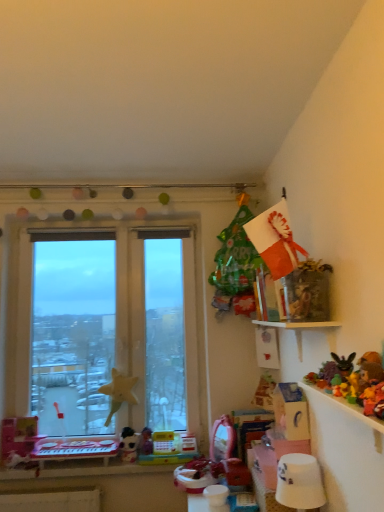
At what (x,y) coordinates should I click in order to perform the action: click on white glossy lampshade at lower right. Please return your answer as a coordinate pair (x, y). Looking at the image, I should click on (299, 482).

What is the approximate width of white glossy lampshade at lower right?

It is 7.90 inches.

Locate an element on the screen. Image resolution: width=384 pixels, height=512 pixels. white plush toy at lower center, positioned as the 1th toy in back-to-front order is located at coordinates (128, 445).

What do you see at coordinates (371, 368) in the screenshot? I see `fluffy yellow teddy bear at upper right, positioned as the 4th toy in bottom-to-top order` at bounding box center [371, 368].

What do you see at coordinates (335, 386) in the screenshot? I see `multicolored plastic toy at upper right, which is the 3th toy in front-to-back order` at bounding box center [335, 386].

Describe the element at coordinates (373, 400) in the screenshot. The width and height of the screenshot is (384, 512). I see `plush yellow rabbit at upper right, the first toy viewed from the front` at that location.

Measure the distance between point (110, 275) and camera.

A distance of 8.73 feet exists between point (110, 275) and camera.

Identify the location of white glossy lampshade at lower right. This screenshot has height=512, width=384. (299, 482).

From the image's perspective, which is below, white plastic table at lower left or multicolored plastic toy at upper right, the 2th toy viewed from the left?

From the image's view, white plastic table at lower left is below.

How different are the orientations of white plastic table at lower left and multicolored plastic toy at upper right, the second toy from the back, in degrees?

90.9 degrees.

Would you say white plastic table at lower left is to the left or to the right of multicolored plastic toy at upper right, marked as the 3th toy in a right-to-left arrangement, in the picture?

Clearly, white plastic table at lower left is on the left of multicolored plastic toy at upper right, marked as the 3th toy in a right-to-left arrangement, in the image.

Image resolution: width=384 pixels, height=512 pixels. What are the coordinates of `table on the left of the multicolored plastic toy at upper right, positioned as the 3th toy in top-to-bottom order` in the screenshot? It's located at (74, 449).

From the picture: In terms of height, does multicolored plastic toy at upper right, positioned as the 3th toy in top-to-bottom order, look taller or shorter compared to plush yellow rabbit at upper right, the fourth toy from the back?

Considering their sizes, multicolored plastic toy at upper right, positioned as the 3th toy in top-to-bottom order, has less height than plush yellow rabbit at upper right, the fourth toy from the back.

Is multicolored plastic toy at upper right, the second toy from the bottom, beside plush yellow rabbit at upper right, placed as the 3th toy when sorted from left to right?

No, multicolored plastic toy at upper right, the second toy from the bottom, is not with plush yellow rabbit at upper right, placed as the 3th toy when sorted from left to right.

Does multicolored plastic toy at upper right, marked as the 3th toy in a right-to-left arrangement, have a larger size compared to plush yellow rabbit at upper right, which is the 3th toy in bottom-to-top order?

Actually, multicolored plastic toy at upper right, marked as the 3th toy in a right-to-left arrangement, might be smaller than plush yellow rabbit at upper right, which is the 3th toy in bottom-to-top order.

From the image's perspective, who appears lower, plush yellow rabbit at upper right, which is the 3th toy in bottom-to-top order, or white plastic table at lower left?

white plastic table at lower left, from the image's perspective.

Is plush yellow rabbit at upper right, placed as the 3th toy when sorted from left to right, turned away from white plastic table at lower left?

No, plush yellow rabbit at upper right, placed as the 3th toy when sorted from left to right,'s orientation is not away from white plastic table at lower left.

Where is `table that appears below the plush yellow rabbit at upper right, which is the 3th toy in bottom-to-top order (from a real-world perspective)`? table that appears below the plush yellow rabbit at upper right, which is the 3th toy in bottom-to-top order (from a real-world perspective) is located at coordinates (74, 449).

Which is behind, point (166, 262) or point (291, 483)?

Point (166, 262)

Is transparent glass window at left looking in the opposite direction of white glossy lampshade at lower right?

transparent glass window at left does not have its back to white glossy lampshade at lower right.

Considering the positions of objects transparent glass window at left and white glossy lampshade at lower right in the image provided, who is more to the left, transparent glass window at left or white glossy lampshade at lower right?

Positioned to the left is transparent glass window at left.

Where is `window behind the white glossy lampshade at lower right`? This screenshot has height=512, width=384. window behind the white glossy lampshade at lower right is located at coordinates (108, 327).

Is plush yellow rabbit at upper right, which is the 3th toy in bottom-to-top order, next to white glossy lampshade at lower right and touching it?

No, plush yellow rabbit at upper right, which is the 3th toy in bottom-to-top order, is not in contact with white glossy lampshade at lower right.

Considering the sizes of objects plush yellow rabbit at upper right, the 2th toy from the right, and white glossy lampshade at lower right in the image provided, who is smaller, plush yellow rabbit at upper right, the 2th toy from the right, or white glossy lampshade at lower right?

With smaller size is plush yellow rabbit at upper right, the 2th toy from the right.

From the white glossy lampshade at lower right, count 3rd toys forward and point to it. Please provide its 2D coordinates.

[(373, 400)]

Can you tell me how much plush yellow rabbit at upper right, the first toy viewed from the front, and white glossy lampshade at lower right differ in facing direction?

plush yellow rabbit at upper right, the first toy viewed from the front, and white glossy lampshade at lower right are facing 1.79 degrees away from each other.

Relative to white plush toy at lower center, placed as the fourth toy when sorted from front to back, is transparent glass window at left in front or behind?

Visually, transparent glass window at left is located behind white plush toy at lower center, placed as the fourth toy when sorted from front to back.

Is transparent glass window at left inside the boundaries of white plush toy at lower center, placed as the fourth toy when sorted from front to back, or outside?

transparent glass window at left exists outside the volume of white plush toy at lower center, placed as the fourth toy when sorted from front to back.

Is transparent glass window at left oriented away from white plush toy at lower center, which is counted as the fourth toy, starting from the right?

Yes, transparent glass window at left's orientation is away from white plush toy at lower center, which is counted as the fourth toy, starting from the right.

In terms of width, does transparent glass window at left look wider or thinner when compared to white plush toy at lower center, positioned as the 1th toy in back-to-front order?

Considering their sizes, transparent glass window at left looks broader than white plush toy at lower center, positioned as the 1th toy in back-to-front order.

Which of these two, plush yellow rabbit at upper right, the first toy viewed from the front, or white plush toy at lower center, which is the first toy from bottom to top, is smaller?

With smaller size is plush yellow rabbit at upper right, the first toy viewed from the front.

Would you say white plush toy at lower center, which is the first toy from bottom to top, is part of plush yellow rabbit at upper right, the 2th toy from the right,'s contents?

No.

Does plush yellow rabbit at upper right, the fourth toy from the back, turn towards white plush toy at lower center, positioned as the 1th toy in back-to-front order?

No, plush yellow rabbit at upper right, the fourth toy from the back, is not facing towards white plush toy at lower center, positioned as the 1th toy in back-to-front order.

Does point (370, 405) lie in front of point (133, 430)?

That is True.

You are a GUI agent. You are given a task and a screenshot of the screen. Output one action in this format:
    pyautogui.click(x=<x>, y=<y>)
    Task: Click on the 2nd toy above the white plastic table at lower left (from the image's perspective)
    
    Given the screenshot: What is the action you would take?
    pyautogui.click(x=335, y=386)

Identify the location of the 1st toy to the right when counting from the multicolored plastic toy at upper right, the 2th toy viewed from the left. (373, 400).

Considering their positions, is multicolored plastic toy at upper right, marked as the 3th toy in a right-to-left arrangement, positioned closer to white glossy lampshade at lower right than white plastic table at lower left?

The object closer to white glossy lampshade at lower right is multicolored plastic toy at upper right, marked as the 3th toy in a right-to-left arrangement.

Which object lies nearer to the anchor point plush yellow rabbit at upper right, which is the 3th toy in bottom-to-top order, white plastic table at lower left or white plush toy at lower center, arranged as the first toy when viewed from the left?

white plush toy at lower center, arranged as the first toy when viewed from the left, is positioned closer to the anchor plush yellow rabbit at upper right, which is the 3th toy in bottom-to-top order.

Estimate the real-world distances between objects in this image. Which object is further from white glossy lampshade at lower right, white plush toy at lower center, which is the first toy from bottom to top, or multicolored plastic toy at upper right, positioned as the 3th toy in top-to-bottom order?

The object further to white glossy lampshade at lower right is white plush toy at lower center, which is the first toy from bottom to top.

Which object lies further to the anchor point white plush toy at lower center, placed as the fourth toy when sorted from front to back, multicolored plastic toy at upper right, the second toy from the back, or white plastic table at lower left?

multicolored plastic toy at upper right, the second toy from the back, lies further to white plush toy at lower center, placed as the fourth toy when sorted from front to back, than the other object.

Which object lies nearer to the anchor point fluffy yellow teddy bear at upper right, which is counted as the fourth toy, starting from the left, white plastic table at lower left or transparent glass window at left?

Based on the image, transparent glass window at left appears to be nearer to fluffy yellow teddy bear at upper right, which is counted as the fourth toy, starting from the left.

Looking at the image, which one is located further to multicolored plastic toy at upper right, positioned as the 3th toy in top-to-bottom order, white plastic table at lower left or white plush toy at lower center, arranged as the first toy when viewed from the left?

white plastic table at lower left is further to multicolored plastic toy at upper right, positioned as the 3th toy in top-to-bottom order.

Estimate the real-world distances between objects in this image. Which object is further from white glossy lampshade at lower right, transparent glass window at left or fluffy yellow teddy bear at upper right, acting as the first toy starting from the right?

The object further to white glossy lampshade at lower right is transparent glass window at left.

Consider the image. Looking at the image, which one is located closer to transparent glass window at left, white plush toy at lower center, which is counted as the fourth toy, starting from the right, or fluffy yellow teddy bear at upper right, the 1th toy positioned from the top?

The object closer to transparent glass window at left is white plush toy at lower center, which is counted as the fourth toy, starting from the right.

Identify the location of lamp located between plush yellow rabbit at upper right, the fourth toy from the back, and white plastic table at lower left in the depth direction. This screenshot has height=512, width=384. (299, 482).

I want to click on table between plush yellow rabbit at upper right, which is the 3th toy in bottom-to-top order, and white plush toy at lower center, placed as the fourth toy when sorted from front to back, along the z-axis, so click(74, 449).

You are a GUI agent. You are given a task and a screenshot of the screen. Output one action in this format:
    pyautogui.click(x=<x>, y=<y>)
    Task: Click on the lamp between white plastic table at lower left and fluffy yellow teddy bear at upper right, which is counted as the fourth toy, starting from the left
    The image size is (384, 512).
    Given the screenshot: What is the action you would take?
    coord(299,482)

Identify the location of toy between plush yellow rabbit at upper right, the second toy from the top, and multicolored plastic toy at upper right, positioned as the 3th toy in top-to-bottom order, from front to back. [371, 368].